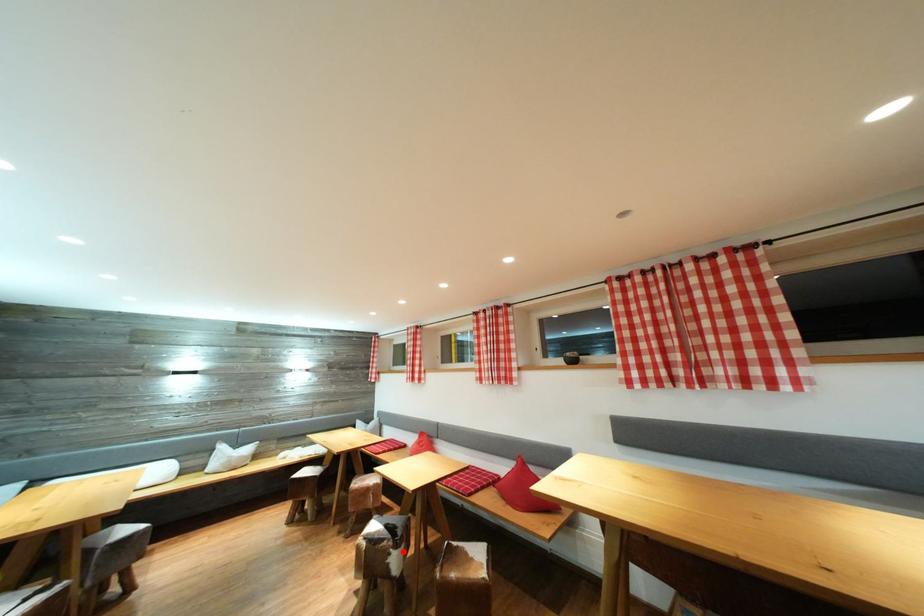
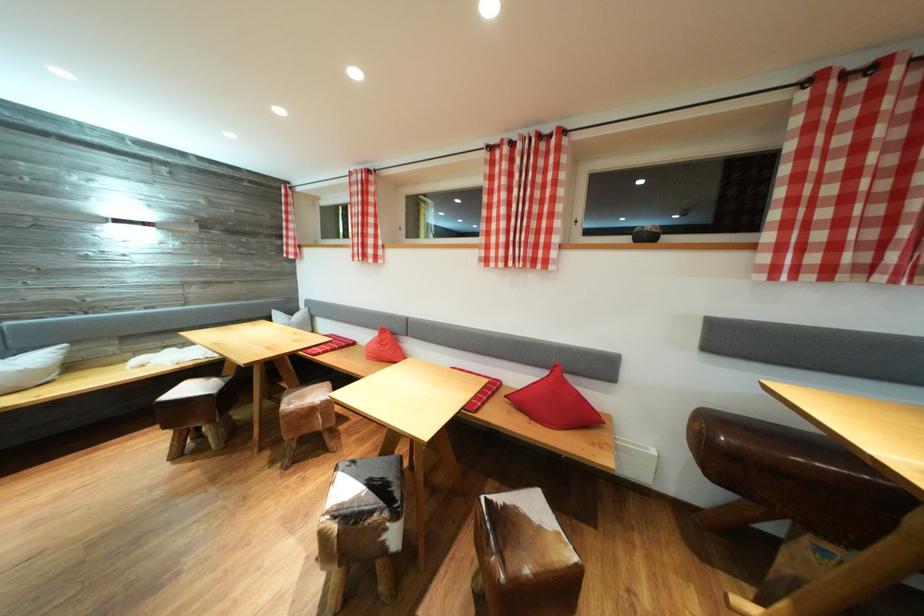
In the second image, find the point that corresponds to the highlighted location in the first image.

(403, 522)